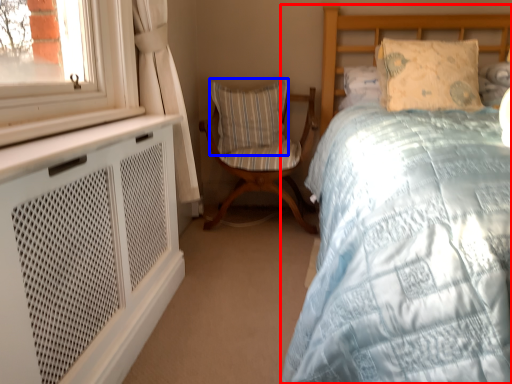
Question: Among these objects, which one is nearest to the camera, bed (highlighted by a red box) or pillow (highlighted by a blue box)?

Choices:
 (A) bed
 (B) pillow

Answer: (A)